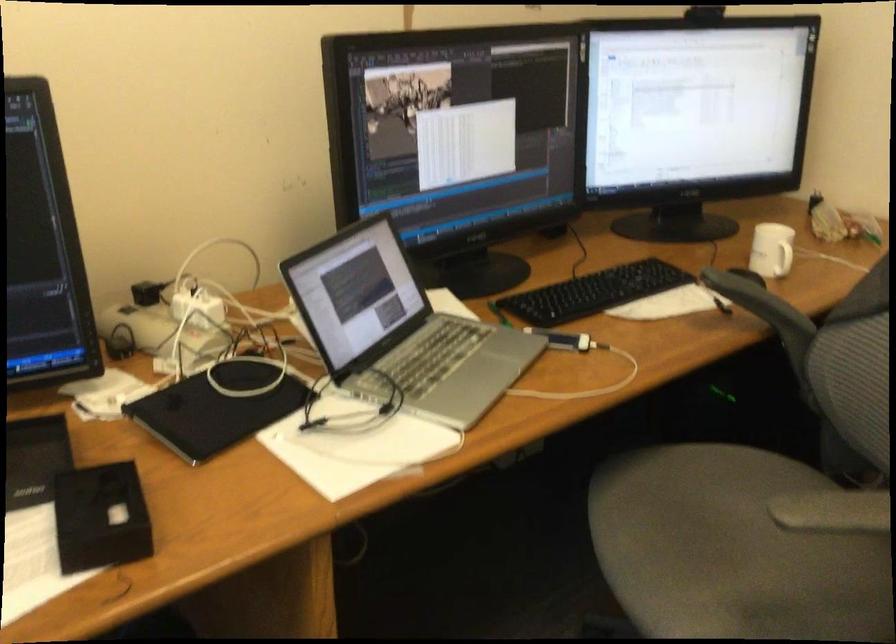
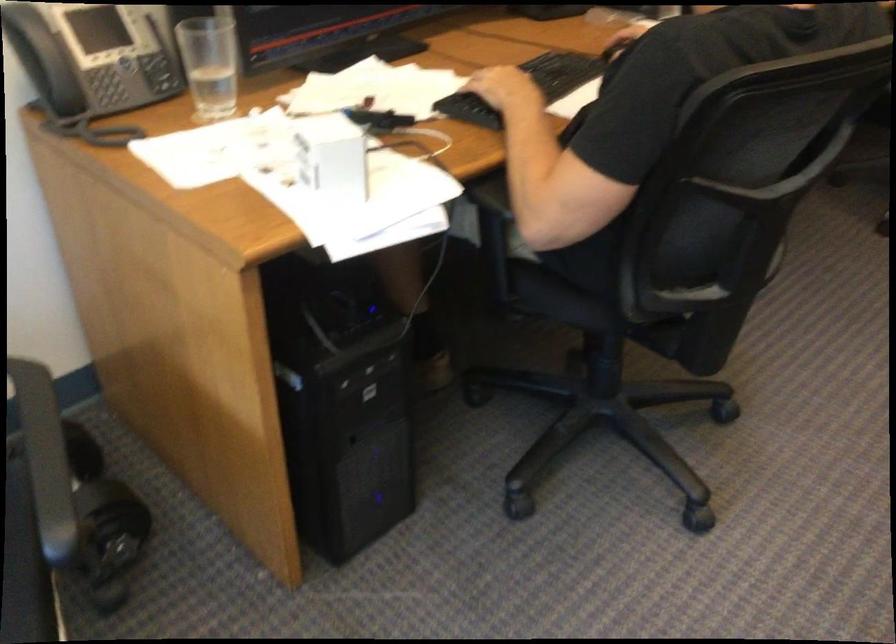
Which direction would the cameraman need to move to produce the second image?

The cameraman walked toward left, backward.